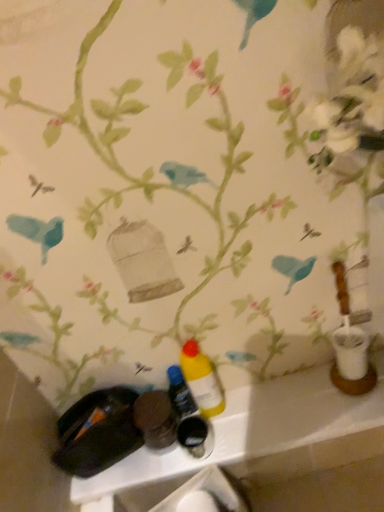
Identify the location of vacant space to the right of yellow matte bottle at center, marked as the second bottle in a right-to-left arrangement. The width and height of the screenshot is (384, 512). (259, 409).